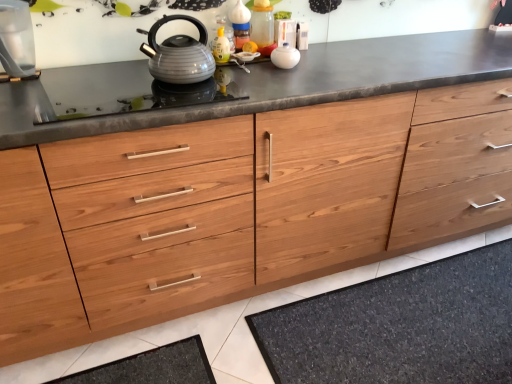
At what (x,y) coordinates should I click in order to perform the action: click on unoccupied region to the right of matte gray kettle at center. Please return your answer as a coordinate pair (x, y). Looking at the image, I should click on (240, 75).